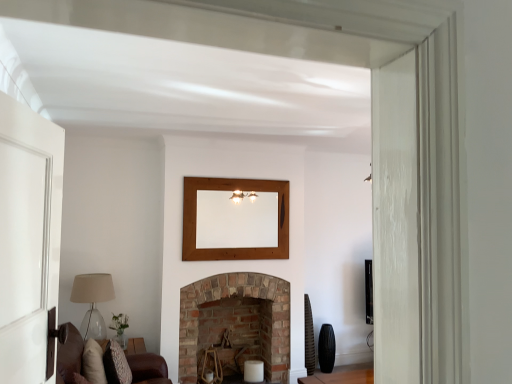
Question: From a real-world perspective, is brown leather couch at lower left physically located above or below wooden mirror at upper center?

Choices:
 (A) above
 (B) below

Answer: (B)

Question: Considering the positions of point (136, 365) and point (257, 235), is point (136, 365) closer or farther from the camera than point (257, 235)?

Choices:
 (A) closer
 (B) farther

Answer: (A)

Question: Which object is the farthest from the brown leather couch at lower left?

Choices:
 (A) translucent glass lampshade at left
 (B) brick fireplace at center
 (C) wooden mirror at upper center

Answer: (C)

Question: Considering the real-world distances, which object is farthest from the translucent glass lampshade at left?

Choices:
 (A) wooden mirror at upper center
 (B) brown leather couch at lower left
 (C) brick fireplace at center

Answer: (A)